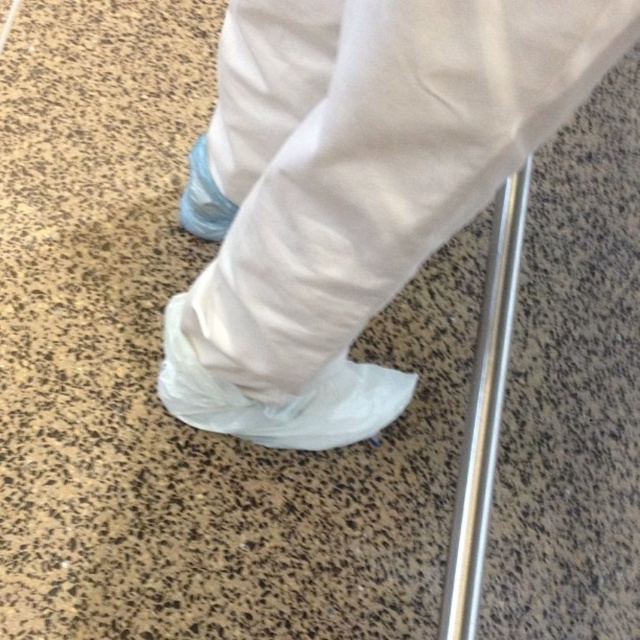
Who is more forward, (476, 566) or (182, 204)?

Positioned in front is point (476, 566).

Does silver metallic rail at center have a lesser width compared to blue fabric shoe at lower left?

No, silver metallic rail at center is not thinner than blue fabric shoe at lower left.

Is point (512, 252) farther from camera compared to point (208, 214)?

No, it is not.

What are the coordinates of `silver metallic rail at center` in the screenshot? It's located at (483, 413).

Is white plastic shoe cover at lower center positioned in front of blue fabric shoe at lower left?

Yes, white plastic shoe cover at lower center is in front of blue fabric shoe at lower left.

Between point (397, 88) and point (212, 228), which one is positioned behind?

The point (212, 228) is more distant.

Where is `white plastic shoe cover at lower center`? The image size is (640, 640). white plastic shoe cover at lower center is located at coordinates (356, 188).

The image size is (640, 640). What do you see at coordinates (282, 404) in the screenshot? I see `white plastic boot at lower center` at bounding box center [282, 404].

Is white plastic boot at lower center taller than blue fabric shoe at lower left?

Correct, white plastic boot at lower center is much taller as blue fabric shoe at lower left.

I want to click on white plastic boot at lower center, so pos(282,404).

You are a GUI agent. You are given a task and a screenshot of the screen. Output one action in this format:
    pyautogui.click(x=<x>, y=<y>)
    Task: Click on the white plastic boot at lower center
    The height and width of the screenshot is (640, 640).
    Given the screenshot: What is the action you would take?
    (x=282, y=404)